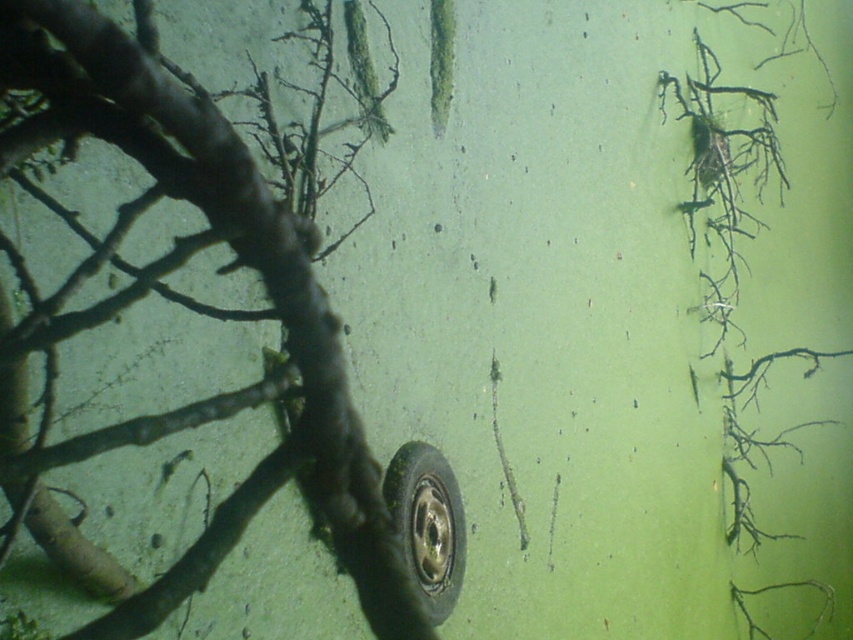
You are standing in front of a green surface with two points marked. The first point is at coordinates point (56, 28) and the second is at point (425, 593). Which point is closer to you?

Point (56, 28) is closer to the viewer than point (425, 593).

Looking at this image, you are standing in front of the green surface shown in the image. There is a brown rough branch at center and a circular object in the center. Which object is exactly at the point with coordinates (265, 289)?

The brown rough branch at center is located at point (265, 289).

You are a maintenance worker inspecting the green surface. You notice the brown rough branch at center and the black rubber tire at center. Which object is positioned higher on the surface?

The brown rough branch at center is positioned higher than the black rubber tire at center according to the description.